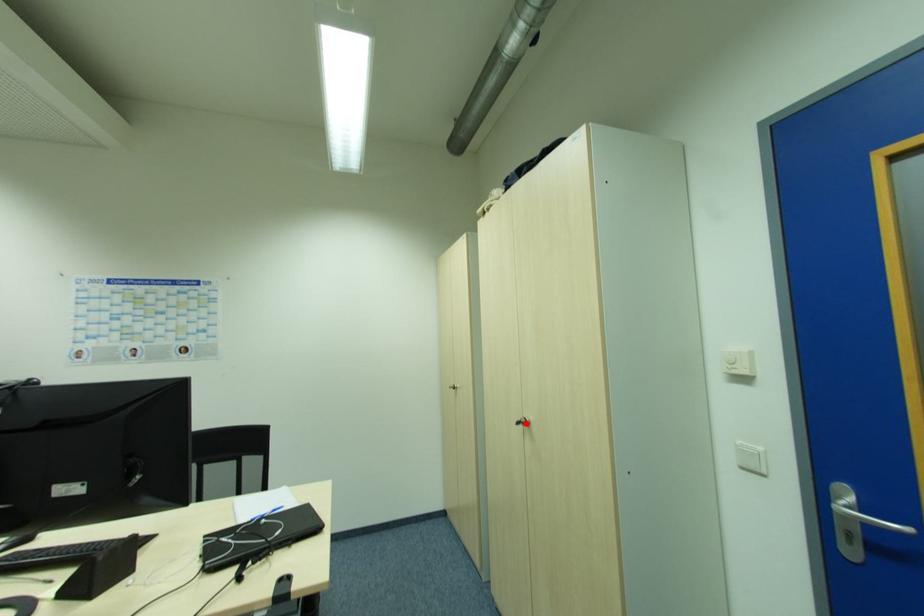
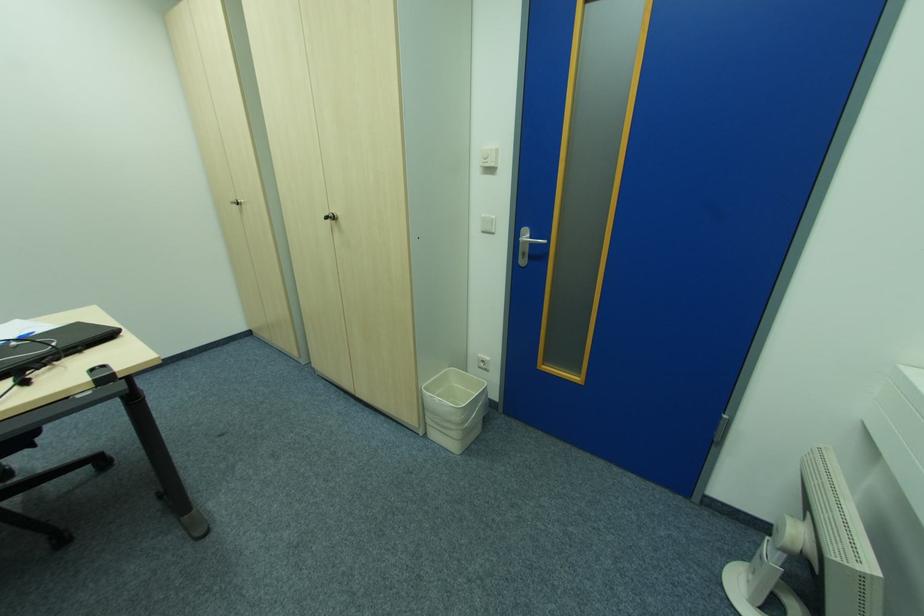
Where in the second image is the point corresponding to the highlighted location from the first image?

(334, 219)